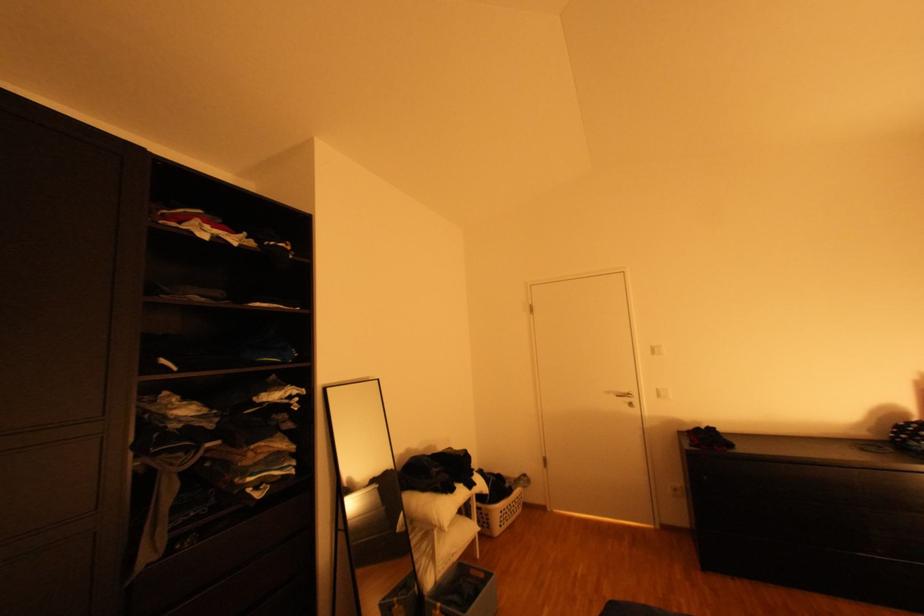
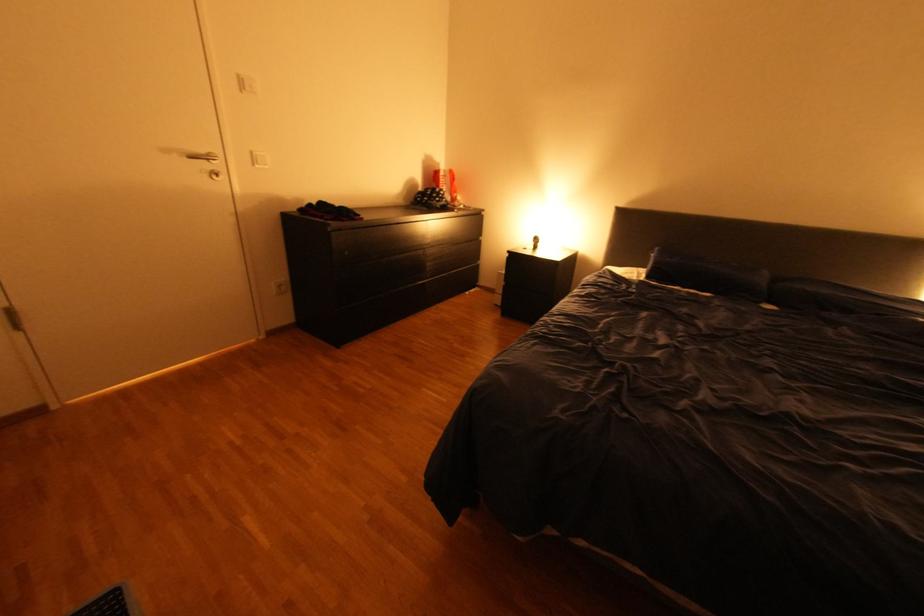
In the second image, find the point that corresponds to the point at 669,395 in the first image.

(264, 161)